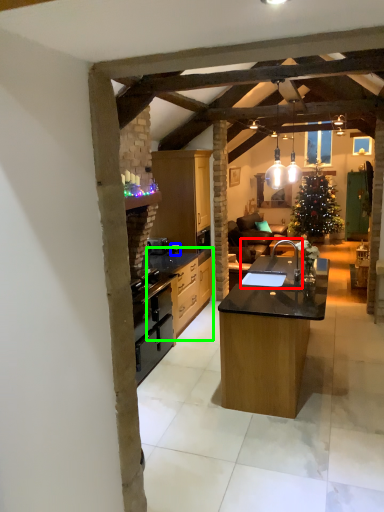
Question: Based on their relative distances, which object is nearer to sink (highlighted by a red box)? Choose from appliance (highlighted by a blue box) and cabinetry (highlighted by a green box).

Choices:
 (A) appliance
 (B) cabinetry

Answer: (B)